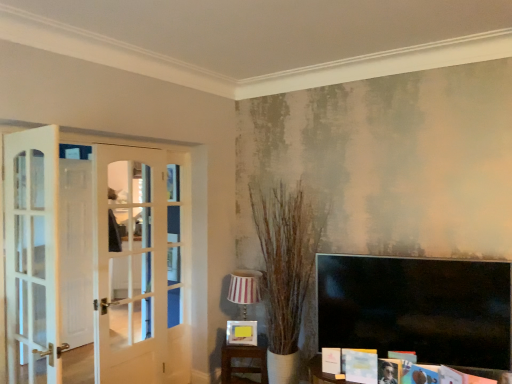
Question: From a real-world perspective, relative to wooden table at lower center, is matte white magazine at lower right vertically above or below?

Choices:
 (A) above
 (B) below

Answer: (A)

Question: Is matte white magazine at lower right wider or thinner than wooden table at lower center?

Choices:
 (A) thin
 (B) wide

Answer: (A)

Question: Which is farther from the matte yellow picture frame at center?

Choices:
 (A) matte white magazine at lower right
 (B) striped fabric lampshade at center
 (C) wooden table at lower center

Answer: (A)

Question: Which is nearer to the wooden table at lower center?

Choices:
 (A) striped fabric lampshade at center
 (B) matte yellow picture frame at center
 (C) matte white magazine at lower right

Answer: (B)